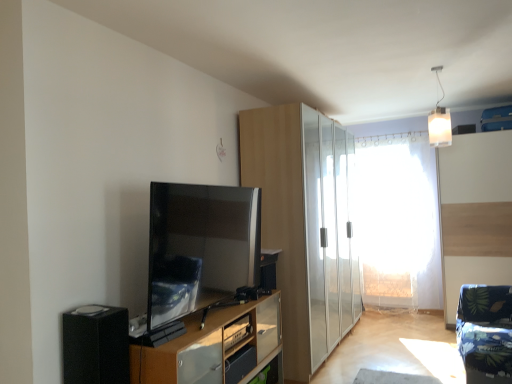
Question: Does transparent plastic curtain at center have a lesser height compared to white frosted glass pendant light at upper right?

Choices:
 (A) no
 (B) yes

Answer: (A)

Question: Does transparent plastic curtain at center have a larger size compared to white frosted glass pendant light at upper right?

Choices:
 (A) yes
 (B) no

Answer: (A)

Question: Is transparent plastic curtain at center positioned far away from white frosted glass pendant light at upper right?

Choices:
 (A) no
 (B) yes

Answer: (B)

Question: Can we say transparent plastic curtain at center lies outside white frosted glass pendant light at upper right?

Choices:
 (A) yes
 (B) no

Answer: (A)

Question: Is transparent plastic curtain at center smaller than white frosted glass pendant light at upper right?

Choices:
 (A) no
 (B) yes

Answer: (A)

Question: From the image's perspective, is transparent plastic curtain at center over white frosted glass pendant light at upper right?

Choices:
 (A) no
 (B) yes

Answer: (A)

Question: Does satin black tv at center turn towards black matte speaker at lower left?

Choices:
 (A) no
 (B) yes

Answer: (A)

Question: Can you confirm if satin black tv at center is bigger than black matte speaker at lower left?

Choices:
 (A) yes
 (B) no

Answer: (A)

Question: Are satin black tv at center and black matte speaker at lower left beside each other?

Choices:
 (A) no
 (B) yes

Answer: (A)

Question: Is satin black tv at center not close to black matte speaker at lower left?

Choices:
 (A) yes
 (B) no

Answer: (B)

Question: From the image's perspective, is satin black tv at center above black matte speaker at lower left?

Choices:
 (A) yes
 (B) no

Answer: (A)

Question: Does satin black tv at center have a greater height compared to black matte speaker at lower left?

Choices:
 (A) yes
 (B) no

Answer: (A)

Question: Is light wood cabinet at center closer to camera compared to transparent plastic curtain at center?

Choices:
 (A) no
 (B) yes

Answer: (B)